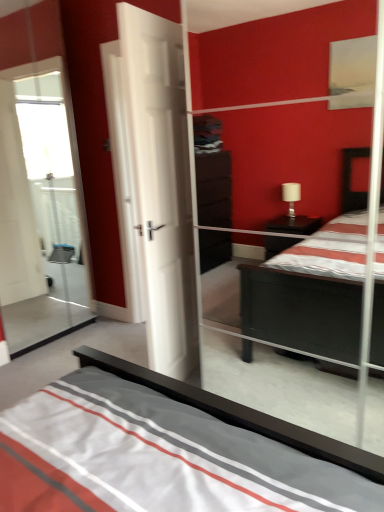
Question: Is white matte door at center behind transparent glass door at left?

Choices:
 (A) yes
 (B) no

Answer: (B)

Question: Is white matte door at center thinner than transparent glass door at left?

Choices:
 (A) yes
 (B) no

Answer: (B)

Question: From a real-world perspective, is white matte door at center below transparent glass door at left?

Choices:
 (A) yes
 (B) no

Answer: (A)

Question: Could you tell me if white matte door at center is facing transparent glass door at left?

Choices:
 (A) no
 (B) yes

Answer: (B)

Question: Is white matte door at center shorter than transparent glass door at left?

Choices:
 (A) no
 (B) yes

Answer: (B)

Question: Is transparent glass door at left a part of white matte door at center?

Choices:
 (A) yes
 (B) no

Answer: (B)

Question: Is transparent glass door at left outside of white matte door at center?

Choices:
 (A) no
 (B) yes

Answer: (B)

Question: Is transparent glass door at left behind white matte door at center?

Choices:
 (A) yes
 (B) no

Answer: (A)

Question: Can you confirm if transparent glass door at left is positioned to the right of white matte door at center?

Choices:
 (A) yes
 (B) no

Answer: (B)

Question: From the image's perspective, is transparent glass door at left located beneath white matte door at center?

Choices:
 (A) no
 (B) yes

Answer: (A)

Question: Considering the relative sizes of transparent glass door at left and white matte door at center in the image provided, is transparent glass door at left smaller than white matte door at center?

Choices:
 (A) yes
 (B) no

Answer: (A)

Question: From a real-world perspective, is transparent glass door at left located higher than white matte door at center?

Choices:
 (A) yes
 (B) no

Answer: (A)

Question: From the image's perspective, is transparent glass door at left positioned above or below white matte door at center?

Choices:
 (A) above
 (B) below

Answer: (A)